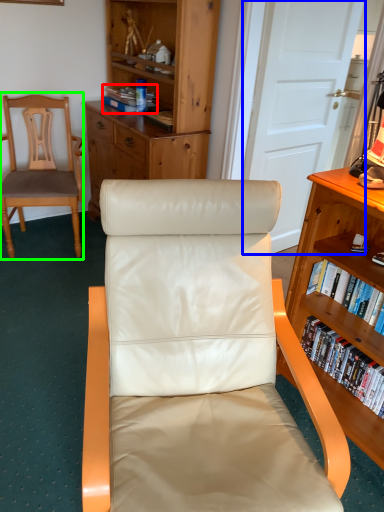
Question: Based on their relative distances, which object is nearer to book (highlighted by a red box)? Choose from door (highlighted by a blue box) and chair (highlighted by a green box).

Choices:
 (A) door
 (B) chair

Answer: (B)